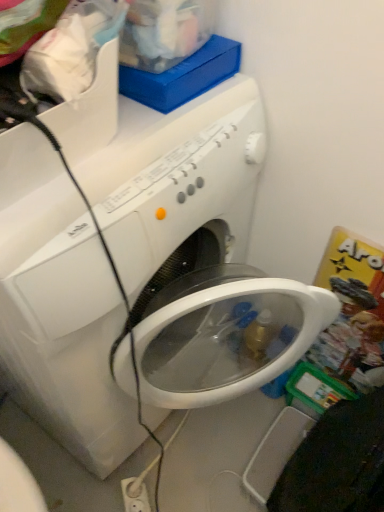
This screenshot has height=512, width=384. Describe the element at coordinates (64, 325) in the screenshot. I see `white glossy washing machine at center` at that location.

Locate an element on the screen. The height and width of the screenshot is (512, 384). white glossy washing machine at center is located at coordinates (64, 325).

The height and width of the screenshot is (512, 384). Identify the location of white plastic electric outlet at lower center. (135, 497).

This screenshot has width=384, height=512. Describe the element at coordinates (135, 497) in the screenshot. I see `white plastic electric outlet at lower center` at that location.

Image resolution: width=384 pixels, height=512 pixels. Find the location of `white glossy washing machine at center`. white glossy washing machine at center is located at coordinates (64, 325).

Which is more to the right, white glossy washing machine at center or white plastic electric outlet at lower center?

white plastic electric outlet at lower center is more to the right.

Considering the relative positions of white glossy washing machine at center and white plastic electric outlet at lower center in the image provided, is white glossy washing machine at center behind white plastic electric outlet at lower center?

No, white glossy washing machine at center is closer to the viewer.

Considering the positions of point (114, 341) and point (139, 503), is point (114, 341) closer or farther from the camera than point (139, 503)?

Point (114, 341) is positioned closer to the camera compared to point (139, 503).

From the image's perspective, is white glossy washing machine at center above white plastic electric outlet at lower center?

Indeed, from the image's perspective, white glossy washing machine at center is shown above white plastic electric outlet at lower center.

From a real-world perspective, is white glossy washing machine at center located beneath white plastic electric outlet at lower center?

No, from a real-world perspective, white glossy washing machine at center is not beneath white plastic electric outlet at lower center.

Considering the sizes of objects white glossy washing machine at center and white plastic electric outlet at lower center in the image provided, who is thinner, white glossy washing machine at center or white plastic electric outlet at lower center?

With smaller width is white plastic electric outlet at lower center.

Considering the sizes of white glossy washing machine at center and white plastic electric outlet at lower center in the image, is white glossy washing machine at center taller or shorter than white plastic electric outlet at lower center?

Considering their sizes, white glossy washing machine at center has more height than white plastic electric outlet at lower center.

Can you confirm if white glossy washing machine at center is smaller than white plastic electric outlet at lower center?

Incorrect, white glossy washing machine at center is not smaller in size than white plastic electric outlet at lower center.

Can white plastic electric outlet at lower center be found inside white glossy washing machine at center?

No, white plastic electric outlet at lower center is not surrounded by white glossy washing machine at center.

Is white glossy washing machine at center positioned far away from white plastic electric outlet at lower center?

Actually, white glossy washing machine at center and white plastic electric outlet at lower center are a little close together.

Is white glossy washing machine at center oriented towards white plastic electric outlet at lower center?

No, white glossy washing machine at center does not turn towards white plastic electric outlet at lower center.

How many degrees apart are the facing directions of white glossy washing machine at center and white plastic electric outlet at lower center?

38.1 degrees separate the facing orientations of white glossy washing machine at center and white plastic electric outlet at lower center.

How far apart are white glossy washing machine at center and white plastic electric outlet at lower center?

They are 22.88 inches apart.

In order to click on electric outlet on the right of white glossy washing machine at center in this screenshot , I will do `click(135, 497)`.

Which object is positioned more to the left, white plastic electric outlet at lower center or white glossy washing machine at center?

white glossy washing machine at center.

Is the depth of white plastic electric outlet at lower center less than that of white glossy washing machine at center?

No, it is not.

Is point (147, 498) more distant than point (185, 397)?

Yes, it is.

From the image's perspective, is white plastic electric outlet at lower center above or below white glossy washing machine at center?

From the image's perspective, white plastic electric outlet at lower center appears below white glossy washing machine at center.

From a real-world perspective, is white plastic electric outlet at lower center on white glossy washing machine at center?

No, from a real-world perspective, white plastic electric outlet at lower center is not on top of white glossy washing machine at center.

Does white plastic electric outlet at lower center have a greater width compared to white glossy washing machine at center?

In fact, white plastic electric outlet at lower center might be narrower than white glossy washing machine at center.

Can you confirm if white plastic electric outlet at lower center is shorter than white glossy washing machine at center?

Yes, white plastic electric outlet at lower center is shorter than white glossy washing machine at center.

Considering the relative sizes of white plastic electric outlet at lower center and white glossy washing machine at center in the image provided, is white plastic electric outlet at lower center bigger than white glossy washing machine at center?

No, white plastic electric outlet at lower center is not bigger than white glossy washing machine at center.

Would you say white plastic electric outlet at lower center is outside white glossy washing machine at center?

Yes, white plastic electric outlet at lower center is located beyond the bounds of white glossy washing machine at center.

Is white plastic electric outlet at lower center not close to white glossy washing machine at center?

No, white plastic electric outlet at lower center is not far from white glossy washing machine at center.

Is white plastic electric outlet at lower center oriented towards white glossy washing machine at center?

No.

What's the angular difference between white plastic electric outlet at lower center and white glossy washing machine at center's facing directions?

The angular difference between white plastic electric outlet at lower center and white glossy washing machine at center is 38.1 degrees.

This screenshot has height=512, width=384. What are the coordinates of `electric outlet located on the right of white glossy washing machine at center` in the screenshot? It's located at (135, 497).

This screenshot has width=384, height=512. In order to click on washing machine in front of the white plastic electric outlet at lower center in this screenshot , I will do pyautogui.click(x=64, y=325).

Image resolution: width=384 pixels, height=512 pixels. Find the location of `washing machine above the white plastic electric outlet at lower center (from a real-world perspective)`. washing machine above the white plastic electric outlet at lower center (from a real-world perspective) is located at coordinates point(64,325).